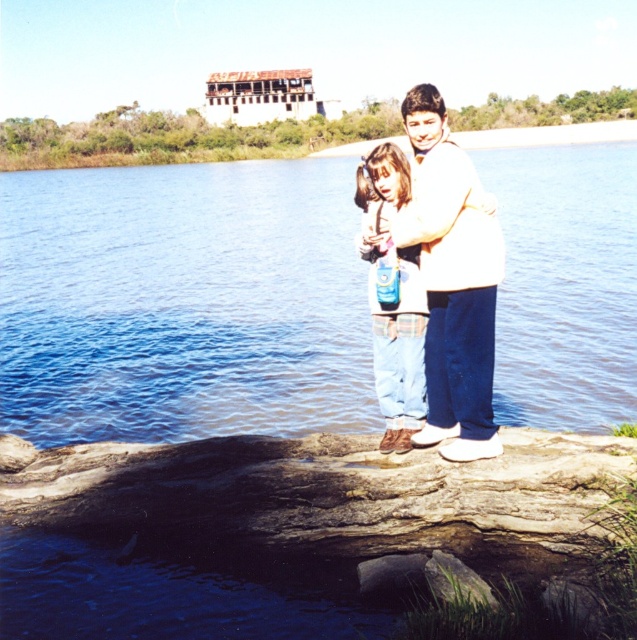
Is white cotton sweater at center positioned in front of denim pants at center?

Yes.

Between white cotton sweater at center and denim pants at center, which one is positioned higher?

white cotton sweater at center is above.

Describe the element at coordinates (452, 280) in the screenshot. I see `white cotton sweater at center` at that location.

Identify the location of white cotton sweater at center. The image size is (637, 640). (452, 280).

Which is above, blue liquid water at center or white cotton sweater at center?

blue liquid water at center is higher up.

Can you confirm if blue liquid water at center is bigger than white cotton sweater at center?

Indeed, blue liquid water at center has a larger size compared to white cotton sweater at center.

Describe the element at coordinates (182, 301) in the screenshot. I see `blue liquid water at center` at that location.

The height and width of the screenshot is (640, 637). In order to click on blue liquid water at center in this screenshot , I will do `click(182, 301)`.

Can you confirm if blue liquid water at center is bigger than denim pants at center?

Yes.

Who is positioned more to the left, blue liquid water at center or denim pants at center?

blue liquid water at center is more to the left.

The width and height of the screenshot is (637, 640). In order to click on blue liquid water at center in this screenshot , I will do `click(182, 301)`.